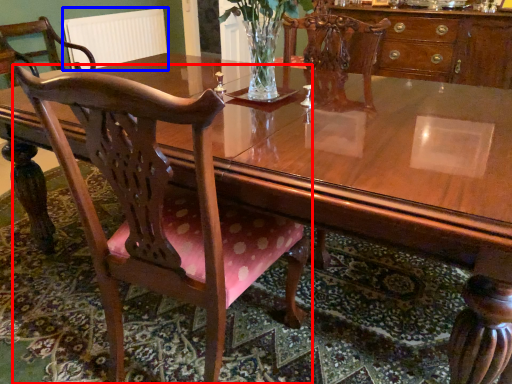
Question: Which object appears farthest to the camera in this image, chair (highlighted by a red box) or radiator (highlighted by a blue box)?

Choices:
 (A) chair
 (B) radiator

Answer: (B)